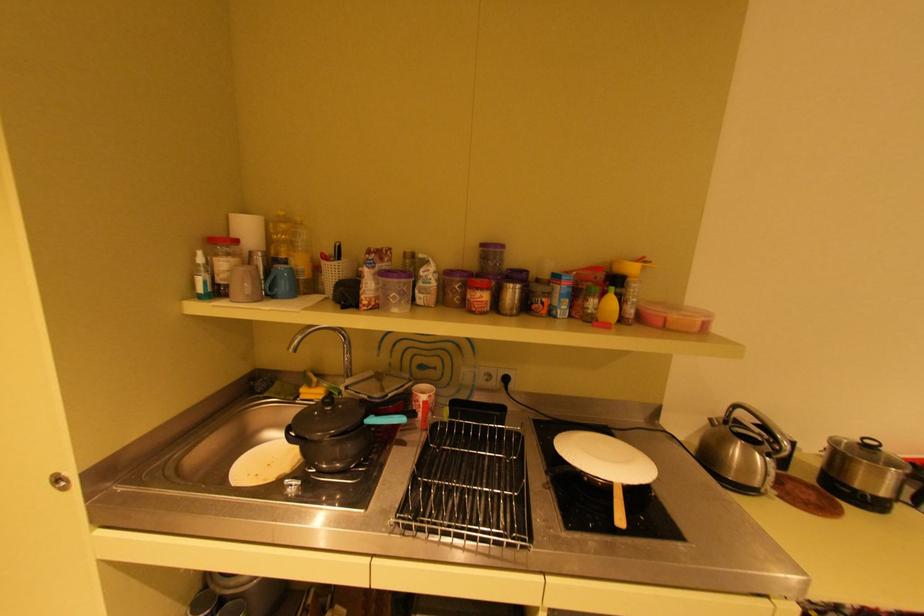
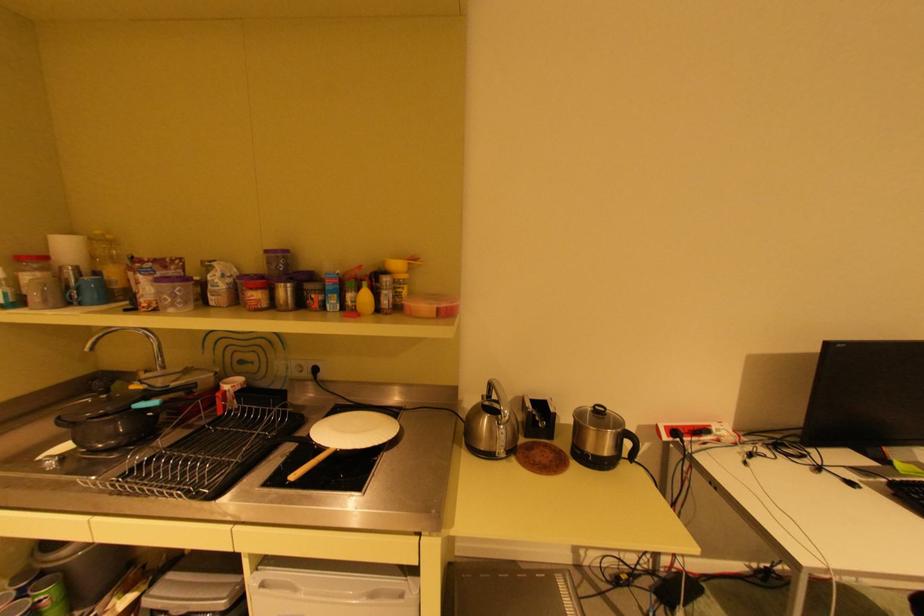
In the second image, find the point that corresponds to (x=611, y=318) in the first image.

(367, 309)